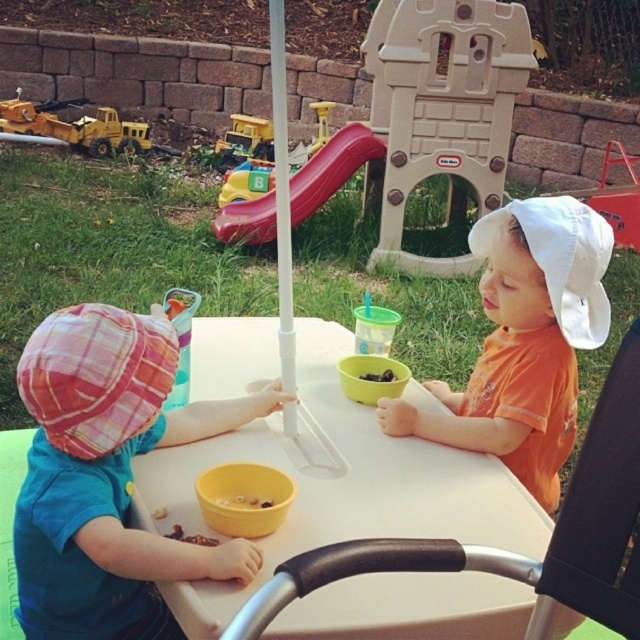
You are a parent trying to decide which toy to give to your child first. The white cotton hat at upper right and the yellow plastic toy truck at left are both on the table. Which one is taller?

The yellow plastic toy truck at left is taller than the white cotton hat at upper right.

You are a parent trying to decide where to place a new toy box in the backyard. The toy box is the same size as the white cotton hat at upper right. Based on the image, can the toy box fit on the white plastic table at center without overlapping the bowls and cup?

The white plastic table at center has a larger size compared to white cotton hat at upper right, so the toy box can fit on the white plastic table at center as long as there is enough space not occupied by the bowls and cup.

Consider the image. You are holding a 1.5 meter long pole. If you want to reach the point at coordinates point (560, 467) from where you are standing, will the pole be long enough?

The distance between the point (560, 467) and the camera is 1.75 meters. Since the pole is 1.5 meters long, it is shorter than the required distance. Therefore, the pole will not be long enough to reach the point.